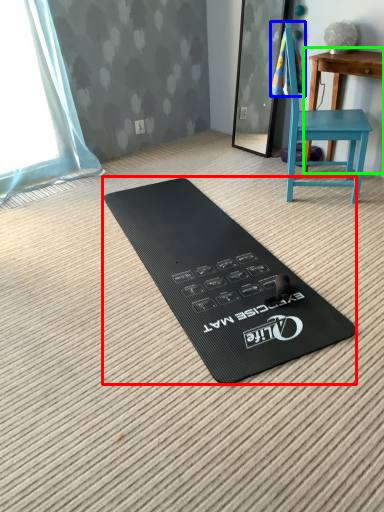
Question: Considering the real-world distances, which object is closest to yoga mat (highlighted by a red box)? beach towel (highlighted by a blue box) or table (highlighted by a green box).

Choices:
 (A) beach towel
 (B) table

Answer: (A)